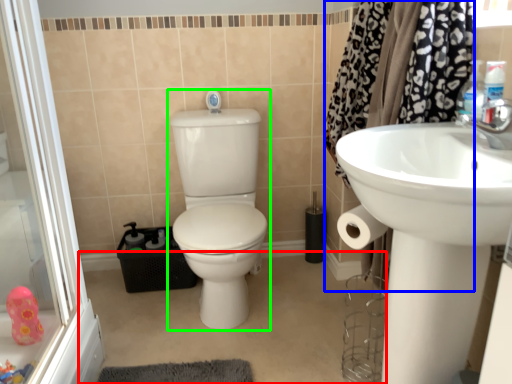
Question: Based on their relative distances, which object is nearer to plain (highlighted by a red box)? Choose from shower curtain (highlighted by a blue box) and sit (highlighted by a green box).

Choices:
 (A) shower curtain
 (B) sit

Answer: (B)